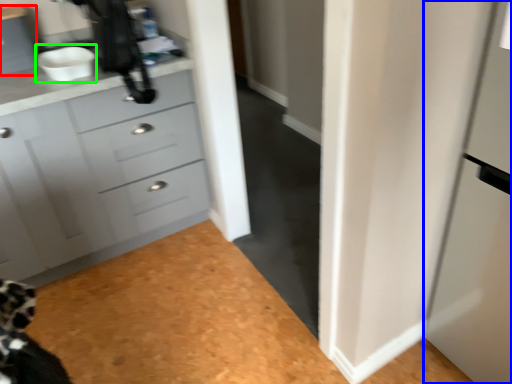
Question: Based on their relative distances, which object is nearer to cabinetry (highlighted by a red box)? Choose from screen door (highlighted by a blue box) and sink (highlighted by a green box).

Choices:
 (A) screen door
 (B) sink

Answer: (B)